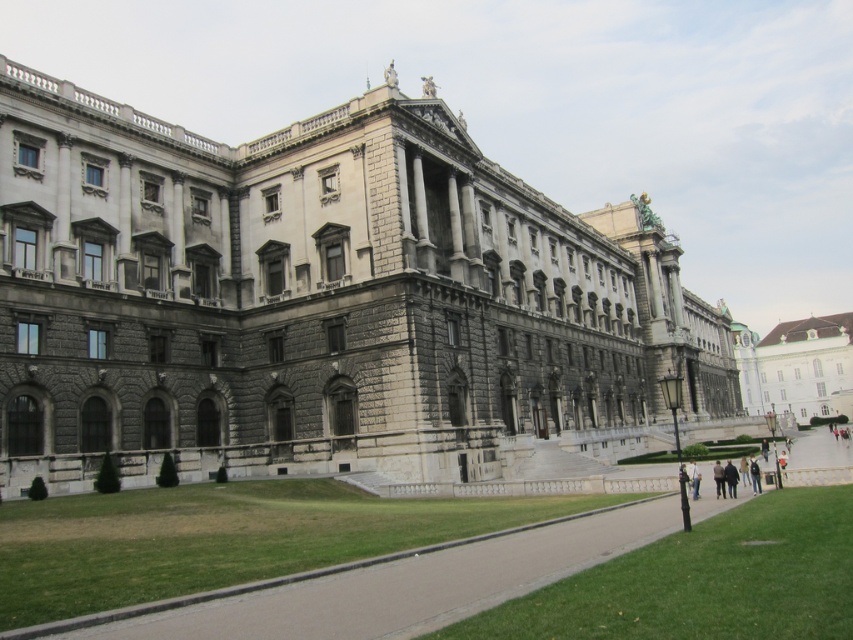
Can you confirm if white glossy palace at right is smaller than dark brown leather jacket at lower right?

No.

What do you see at coordinates (793, 364) in the screenshot? The height and width of the screenshot is (640, 853). I see `white glossy palace at right` at bounding box center [793, 364].

Locate an element on the screen. white glossy palace at right is located at coordinates (793, 364).

Can you confirm if gray stone building at center is taller than white glossy palace at right?

Yes.

Measure the distance between gray stone building at center and camera.

The distance of gray stone building at center from camera is 140.38 feet.

Locate an element on the screen. gray stone building at center is located at coordinates (318, 298).

Is dark brown leather jacket at lower right to the right of light brown leather jacket at lower right from the viewer's perspective?

Yes, dark brown leather jacket at lower right is to the right of light brown leather jacket at lower right.

Between point (732, 493) and point (712, 467), which one is positioned behind?

Positioned behind is point (712, 467).

Which is in front, point (730, 481) or point (715, 474)?

Positioned in front is point (730, 481).

The height and width of the screenshot is (640, 853). In order to click on dark brown leather jacket at lower right in this screenshot , I will do `click(730, 477)`.